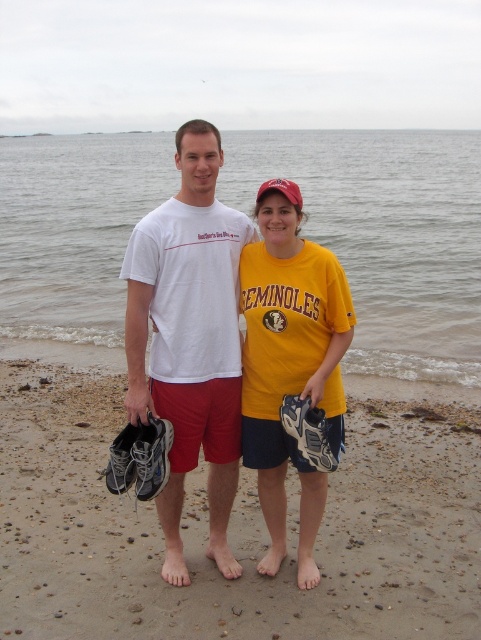
Who is more forward, (450, 596) or (182, 408)?

Positioned in front is point (450, 596).

Between point (100, 508) and point (149, 301), which one is positioned behind?

The point (100, 508) is behind.

The image size is (481, 640). I want to click on brown sandy beach at lower center, so click(x=232, y=529).

Can you confirm if clear water at center is thinner than yellow matte t-shirt at center?

In fact, clear water at center might be wider than yellow matte t-shirt at center.

Based on the photo, who is lower down, clear water at center or yellow matte t-shirt at center?

Positioned lower is yellow matte t-shirt at center.

Which is behind, point (52, 168) or point (294, 387)?

Point (52, 168)

The height and width of the screenshot is (640, 481). What are the coordinates of `clear water at center` in the screenshot? It's located at (385, 236).

Is white matte t-shirt at center above yellow matte t-shirt at center?

Yes, white matte t-shirt at center is above yellow matte t-shirt at center.

From the picture: Is white matte t-shirt at center to the left of yellow matte t-shirt at center from the viewer's perspective?

Indeed, white matte t-shirt at center is positioned on the left side of yellow matte t-shirt at center.

Measure the distance between white matte t-shirt at center and camera.

white matte t-shirt at center and camera are 3.36 meters apart from each other.

Locate an element on the screen. white matte t-shirt at center is located at coordinates (189, 339).